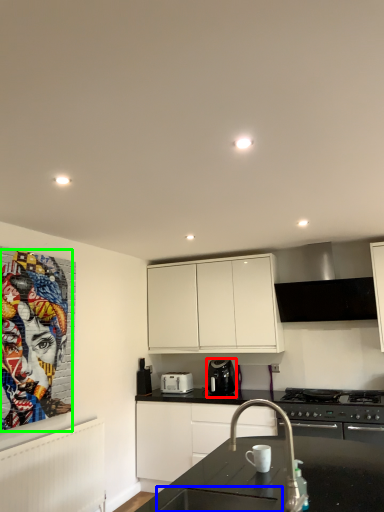
Question: Which object is the farthest from kitchen appliance (highlighted by a red box)? Choose among these: sink (highlighted by a blue box) or person (highlighted by a green box).

Choices:
 (A) sink
 (B) person

Answer: (A)